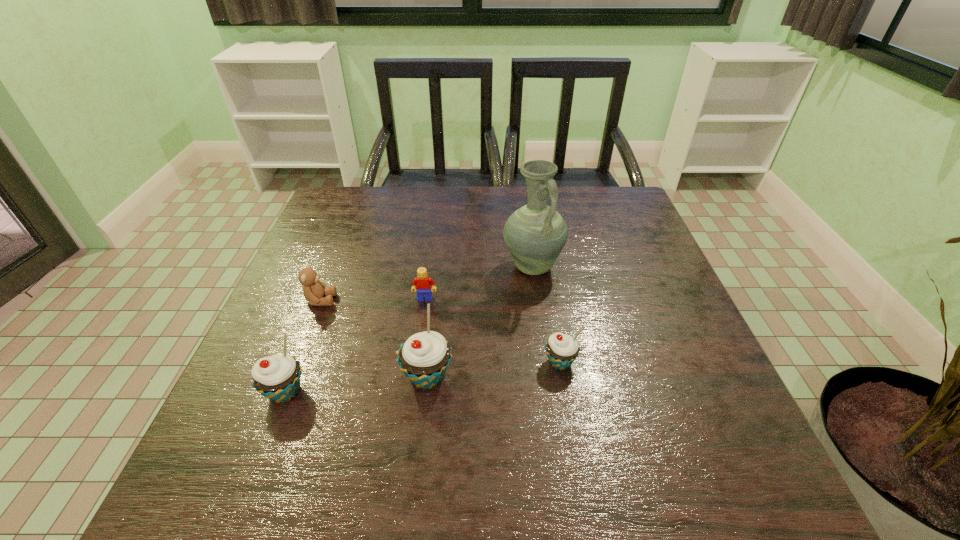
The image size is (960, 540). In order to click on vacant region located on the left of the second cupcake from left to right in this screenshot , I will do `click(251, 376)`.

Image resolution: width=960 pixels, height=540 pixels. Identify the location of vacant region located on the left of the rightmost cupcake. (497, 362).

Where is `vacant area situated 0.240m on the face of the teddy bear`? The width and height of the screenshot is (960, 540). vacant area situated 0.240m on the face of the teddy bear is located at coordinates pos(439,300).

Locate an element on the screen. This screenshot has height=540, width=960. vacant space located on the handle side of the tallest object is located at coordinates (538, 305).

Locate an element on the screen. The height and width of the screenshot is (540, 960). vacant space positioned on the face of the Lego is located at coordinates (414, 381).

I want to click on cupcake that is at the left edge, so click(x=277, y=377).

The width and height of the screenshot is (960, 540). I want to click on teddy bear that is at the left edge, so click(314, 290).

Where is `object at the near left corner`? Image resolution: width=960 pixels, height=540 pixels. object at the near left corner is located at coordinates (277, 377).

Identify the location of vacant space at the far edge of the desktop. (510, 210).

At what (x,y) coordinates should I click in order to perform the action: click on free space at the near edge of the desktop. Please return your answer as a coordinate pair (x, y). Looking at the image, I should click on (460, 418).